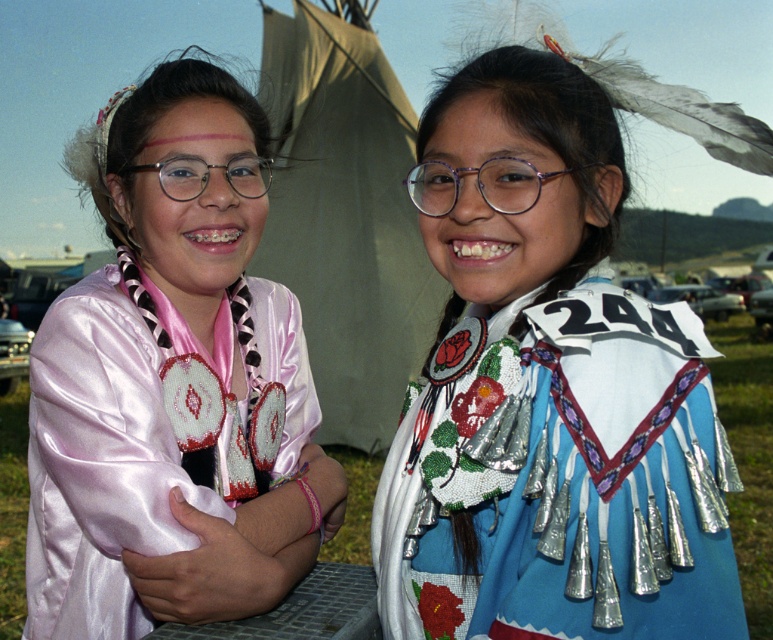
Does point (542, 422) come closer to viewer compared to point (288, 140)?

Yes, point (542, 422) is closer to viewer.

Looking at this image, can you confirm if blue beaded dress at center is smaller than beige canvas tent at center?

Actually, blue beaded dress at center might be larger than beige canvas tent at center.

What are the coordinates of `blue beaded dress at center` in the screenshot? It's located at (543, 388).

Where is `blue beaded dress at center`? This screenshot has width=773, height=640. blue beaded dress at center is located at coordinates (543, 388).

Can you confirm if blue beaded dress at center is taller than satin pink blouse at left?

In fact, blue beaded dress at center may be shorter than satin pink blouse at left.

Does point (707, 394) lie behind point (256, 144)?

No, it is not.

Is point (513, 310) positioned after point (172, 140)?

No, (513, 310) is closer to viewer.

In order to click on blue beaded dress at center in this screenshot , I will do `click(543, 388)`.

Does satin pink blouse at left have a lesser height compared to beige canvas tent at center?

No, satin pink blouse at left is not shorter than beige canvas tent at center.

Does satin pink blouse at left have a lesser width compared to beige canvas tent at center?

No.

Describe the element at coordinates (172, 378) in the screenshot. The image size is (773, 640). I see `satin pink blouse at left` at that location.

This screenshot has height=640, width=773. I want to click on satin pink blouse at left, so click(x=172, y=378).